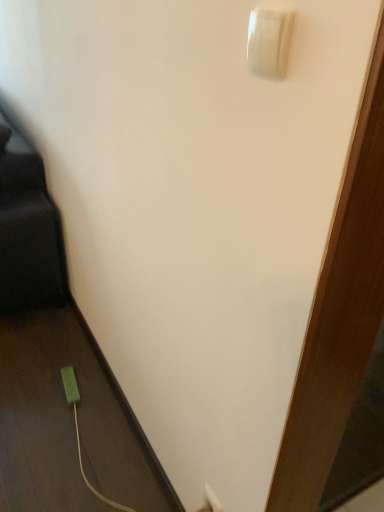
The height and width of the screenshot is (512, 384). I want to click on white glossy light switch at upper right, so click(x=269, y=42).

What is the approximate width of white glossy light switch at upper right?

It is 2.68 centimeters.

The height and width of the screenshot is (512, 384). What do you see at coordinates (269, 42) in the screenshot?
I see `white glossy light switch at upper right` at bounding box center [269, 42].

What do you see at coordinates (70, 385) in the screenshot? The image size is (384, 512). I see `green plastic power plug at lower left` at bounding box center [70, 385].

This screenshot has width=384, height=512. What are the coordinates of `green plastic power plug at lower left` in the screenshot? It's located at (70, 385).

You are a GUI agent. You are given a task and a screenshot of the screen. Output one action in this format:
    pyautogui.click(x=<x>, y=<y>)
    Task: Click on the white glossy light switch at upper right
    The image size is (384, 512).
    Given the screenshot: What is the action you would take?
    pyautogui.click(x=269, y=42)

Which is more to the left, green plastic power plug at lower left or white glossy light switch at upper right?

green plastic power plug at lower left is more to the left.

Is the depth of green plastic power plug at lower left greater than that of white glossy light switch at upper right?

Yes, it is behind white glossy light switch at upper right.

Is point (71, 399) in front of point (273, 60)?

That is False.

From the image's perspective, between green plastic power plug at lower left and white glossy light switch at upper right, who is located below?

green plastic power plug at lower left, from the image's perspective.

From a real-world perspective, which is physically above, green plastic power plug at lower left or white glossy light switch at upper right?

white glossy light switch at upper right is physically above.

Consider the image. Which of these two, green plastic power plug at lower left or white glossy light switch at upper right, is thinner?

With smaller width is white glossy light switch at upper right.

Who is shorter, green plastic power plug at lower left or white glossy light switch at upper right?

With less height is green plastic power plug at lower left.

Does green plastic power plug at lower left have a larger size compared to white glossy light switch at upper right?

Yes, green plastic power plug at lower left is bigger than white glossy light switch at upper right.

Do you think green plastic power plug at lower left is within white glossy light switch at upper right, or outside of it?

green plastic power plug at lower left lies outside white glossy light switch at upper right.

Is green plastic power plug at lower left positioned far away from white glossy light switch at upper right?

green plastic power plug at lower left is far away from white glossy light switch at upper right.

Is green plastic power plug at lower left aimed at white glossy light switch at upper right?

No, green plastic power plug at lower left is not aimed at white glossy light switch at upper right.

At what (x,y) coordinates should I click in order to perform the action: click on power plugs and sockets behind the white glossy light switch at upper right. Please return your answer as a coordinate pair (x, y). The height and width of the screenshot is (512, 384). Looking at the image, I should click on (70, 385).

Considering the relative positions of white glossy light switch at upper right and green plastic power plug at lower left in the image provided, is white glossy light switch at upper right to the left of green plastic power plug at lower left from the viewer's perspective?

No.

Is the position of white glossy light switch at upper right less distant than that of green plastic power plug at lower left?

That is True.

Does point (267, 49) lie behind point (74, 399)?

That is False.

From the image's perspective, which one is positioned lower, white glossy light switch at upper right or green plastic power plug at lower left?

green plastic power plug at lower left appears lower in the image.

From a real-world perspective, is white glossy light switch at upper right physically located above or below green plastic power plug at lower left?

white glossy light switch at upper right is situated higher than green plastic power plug at lower left in the real world.

Which object is thinner, white glossy light switch at upper right or green plastic power plug at lower left?

white glossy light switch at upper right.

Consider the image. Does white glossy light switch at upper right have a greater height compared to green plastic power plug at lower left?

Indeed, white glossy light switch at upper right has a greater height compared to green plastic power plug at lower left.

Between white glossy light switch at upper right and green plastic power plug at lower left, which one has smaller size?

white glossy light switch at upper right.

Is green plastic power plug at lower left surrounded by white glossy light switch at upper right?

No, green plastic power plug at lower left is located outside of white glossy light switch at upper right.

Does white glossy light switch at upper right touch green plastic power plug at lower left?

white glossy light switch at upper right and green plastic power plug at lower left are clearly separated.

Is white glossy light switch at upper right positioned with its back to green plastic power plug at lower left?

white glossy light switch at upper right does not have its back to green plastic power plug at lower left.

How many degrees apart are the facing directions of white glossy light switch at upper right and green plastic power plug at lower left?

There is a 5.7-degree angle between the facing directions of white glossy light switch at upper right and green plastic power plug at lower left.

This screenshot has height=512, width=384. In order to click on light switch above the green plastic power plug at lower left (from a real-world perspective) in this screenshot , I will do `click(269, 42)`.

The height and width of the screenshot is (512, 384). I want to click on light switch that appears on the right of green plastic power plug at lower left, so click(x=269, y=42).

At what (x,y) coordinates should I click in order to perform the action: click on power plugs and sockets that is behind the white glossy light switch at upper right. Please return your answer as a coordinate pair (x, y). The height and width of the screenshot is (512, 384). Looking at the image, I should click on (70, 385).